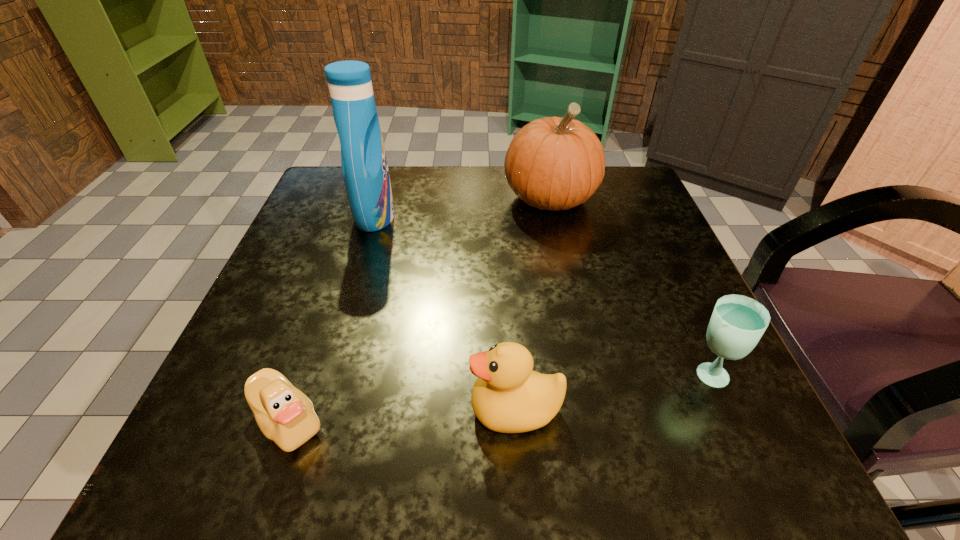
The width and height of the screenshot is (960, 540). In order to click on free space between the left duck and the pumpkin in this screenshot , I will do `click(419, 309)`.

This screenshot has height=540, width=960. Identify the location of free point between the detergent and the left duck. (331, 318).

You are a GUI agent. You are given a task and a screenshot of the screen. Output one action in this format:
    pyautogui.click(x=<x>, y=<y>)
    Task: Click on the vacant area between the detergent and the second tallest object
    The height and width of the screenshot is (540, 960).
    Given the screenshot: What is the action you would take?
    pyautogui.click(x=463, y=207)

Where is `free area in between the right duck and the left duck`? free area in between the right duck and the left duck is located at coordinates (401, 415).

Locate an element on the screen. vacant space that's between the detergent and the second tallest object is located at coordinates (463, 207).

I want to click on empty space between the fourth shortest object and the glass, so click(629, 286).

Locate which object ranks fourth in proximity to the glass. Please provide its 2D coordinates. Your answer should be formatted as a tuple, i.e. [(x, y)], where the tuple contains the x and y coordinates of a point satisfying the conditions above.

[(365, 171)]

Image resolution: width=960 pixels, height=540 pixels. I want to click on object that can be found as the closest to the second tallest object, so click(365, 171).

Where is `vacant area that satisfies the following two spatial constraints: 1. on the front-facing side of the tallest object; 2. at the beak of the shortest object`? This screenshot has width=960, height=540. vacant area that satisfies the following two spatial constraints: 1. on the front-facing side of the tallest object; 2. at the beak of the shortest object is located at coordinates (313, 420).

Locate an element on the screen. This screenshot has width=960, height=540. free space that satisfies the following two spatial constraints: 1. on the front-facing side of the tallest object; 2. at the beak of the left duck is located at coordinates (313, 420).